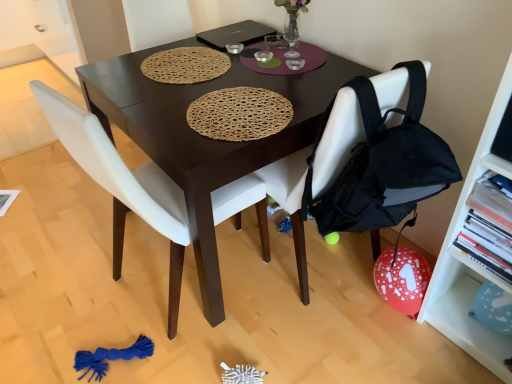
Where is `free space on the front side of black matte laptop at upper center`? The image size is (512, 384). free space on the front side of black matte laptop at upper center is located at coordinates (233, 55).